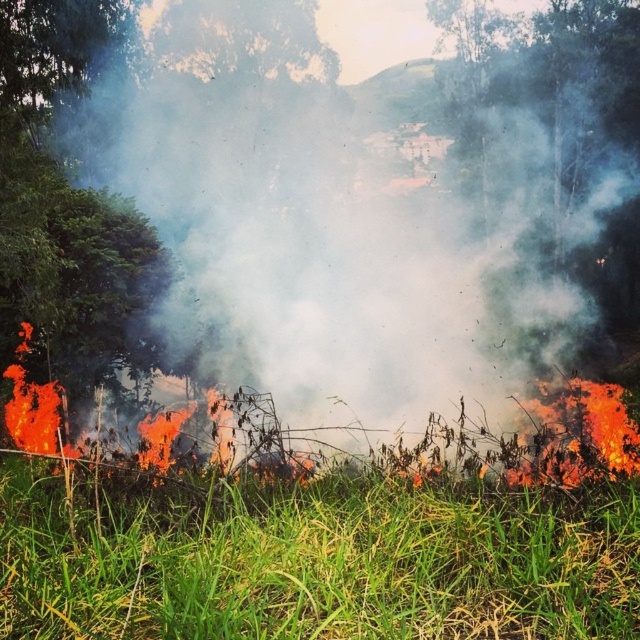
Does white smoke at center appear over green grass at lower center?

Indeed, white smoke at center is positioned over green grass at lower center.

Which is in front, point (460, 442) or point (589, 634)?

Point (589, 634)

Consider the image. Who is more forward, (200, 296) or (483, 554)?

Point (483, 554) is in front.

The width and height of the screenshot is (640, 640). I want to click on white smoke at center, so click(352, 234).